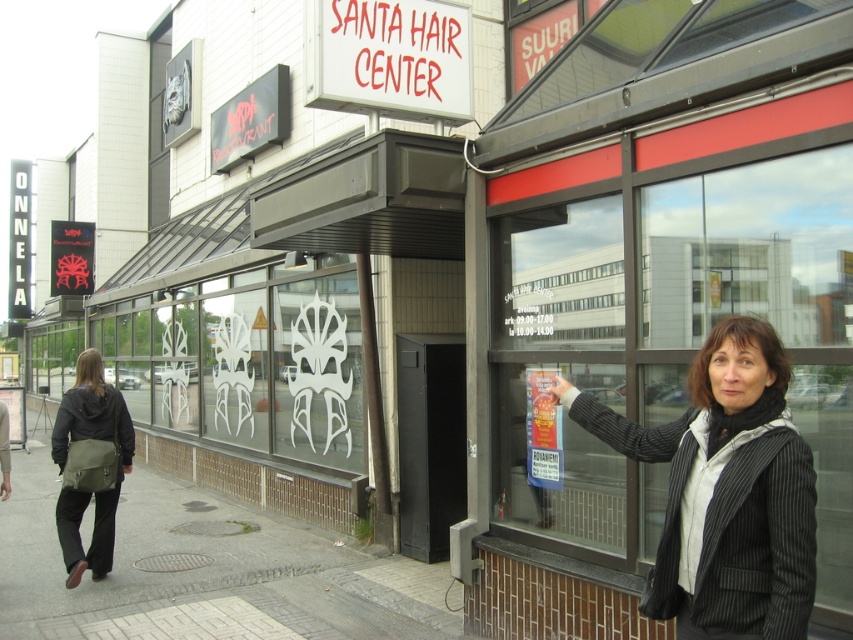
Question: Which of the following is the farthest from the observer?

Choices:
 (A) black pinstripe blazer at lower right
 (B) gray cobblestone pavement at lower left

Answer: (B)

Question: Which object appears closest to the camera in this image?

Choices:
 (A) transparent glass window at center
 (B) gray concrete sidewalk at lower left
 (C) gray cobblestone pavement at lower left
 (D) black pinstripe blazer at lower right

Answer: (D)

Question: Does transparent glass window at center have a larger size compared to olive green fabric bag at left?

Choices:
 (A) no
 (B) yes

Answer: (B)

Question: Which object is the closest to the gray concrete sidewalk at lower left?

Choices:
 (A) olive green fabric bag at left
 (B) gray cobblestone pavement at lower left
 (C) black pinstripe blazer at lower right

Answer: (A)

Question: Is black pinstripe blazer at lower right to the left of gray cobblestone pavement at lower left from the viewer's perspective?

Choices:
 (A) yes
 (B) no

Answer: (B)

Question: Does gray concrete sidewalk at lower left appear under olive green fabric bag at left?

Choices:
 (A) no
 (B) yes

Answer: (B)